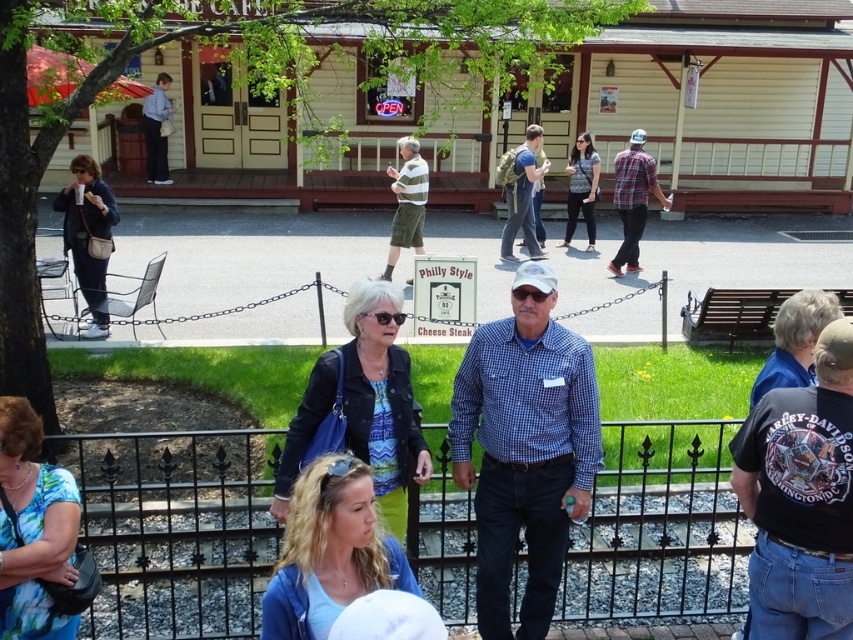
Based on the photo, you are a photographer trying to capture both the black leather jacket at center and the plaid fabric shirt at upper right in the same frame. Given their sizes, which one should you zoom in on to ensure both are visible clearly?

The black leather jacket at center is smaller than the plaid fabric shirt at upper right. To include both clearly, zoom out slightly so that the larger plaid fabric shirt at upper right remains in frame while the smaller black leather jacket at center stays visible.

You are a tour guide standing at the black wrought iron fence. You notice the floral blouse at center and the blue denim jacket at lower right. Which of these two items is closer to you?

The floral blouse at center is closer to you because it is in front of the blue denim jacket at lower right.

You are a photographer trying to capture a clear shot of the vintage CAFE building in the background. However, two people in the foreground are blocking your view. The individuals are wearing a blue checkered shirt at center and a matte blue shirt at center. Which of the two shirts should you adjust to get a clearer view of the CAFE building?

The blue checkered shirt at center is below the matte blue shirt at center, so adjusting the person in the blue checkered shirt at center would allow you to see above them and get a clearer view of the vintage CAFE building.